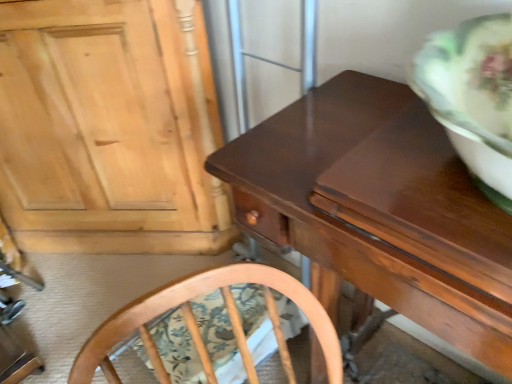
Question: Considering the relative positions of shiny brown wood table at center and light wood cabinet at upper left in the image provided, is shiny brown wood table at center to the left or to the right of light wood cabinet at upper left?

Choices:
 (A) left
 (B) right

Answer: (B)

Question: From a real-world perspective, relative to light wood cabinet at upper left, is shiny brown wood table at center vertically above or below?

Choices:
 (A) below
 (B) above

Answer: (B)

Question: Considering the positions of shiny brown wood table at center and light wood cabinet at upper left in the image, is shiny brown wood table at center wider or thinner than light wood cabinet at upper left?

Choices:
 (A) thin
 (B) wide

Answer: (B)

Question: From the image's perspective, is light wood cabinet at upper left positioned above or below shiny brown wood table at center?

Choices:
 (A) above
 (B) below

Answer: (A)

Question: In terms of height, does light wood cabinet at upper left look taller or shorter compared to shiny brown wood table at center?

Choices:
 (A) short
 (B) tall

Answer: (B)

Question: Is light wood cabinet at upper left wider or thinner than shiny brown wood table at center?

Choices:
 (A) wide
 (B) thin

Answer: (B)

Question: From a real-world perspective, is light wood cabinet at upper left above or below shiny brown wood table at center?

Choices:
 (A) below
 (B) above

Answer: (A)